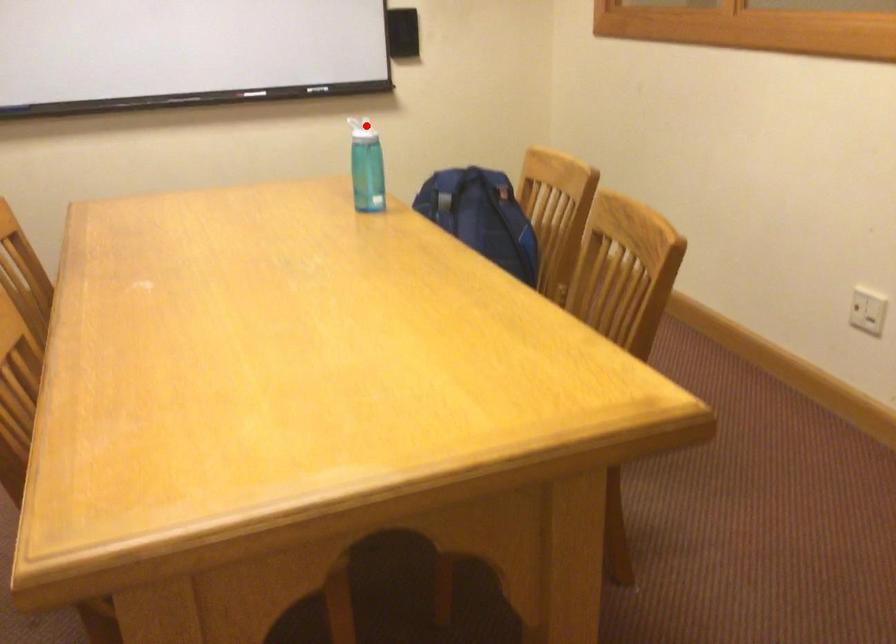
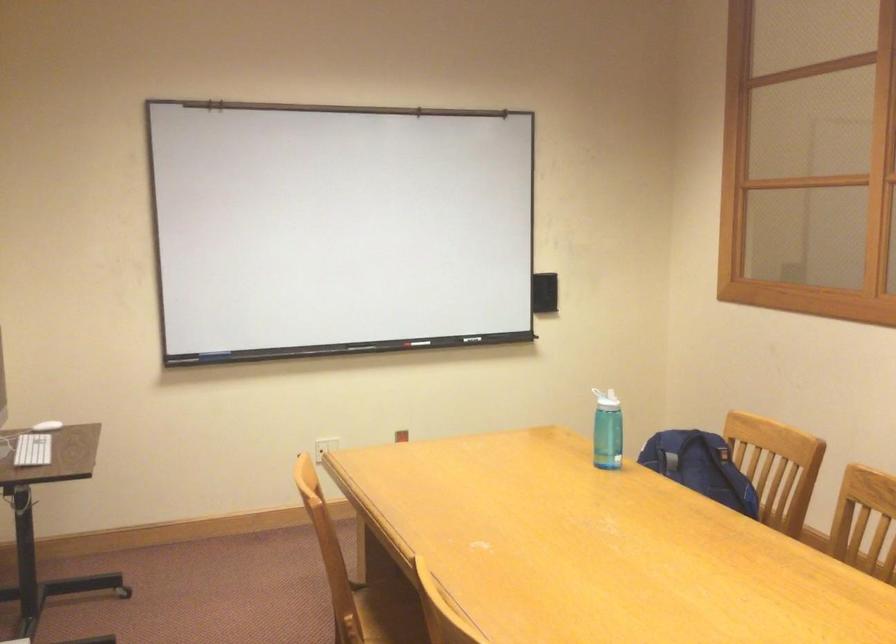
The point at the highlighted location is marked in the first image. Where is the corresponding point in the second image?

(606, 399)